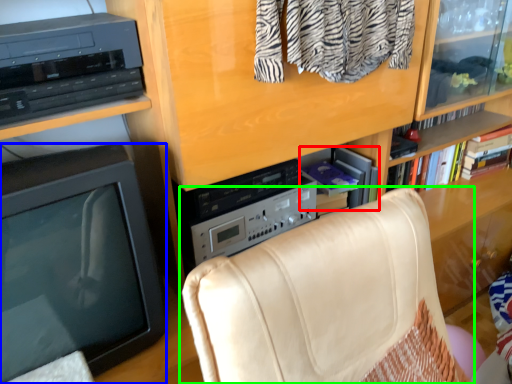
Question: Based on their relative distances, which object is farther from book (highlighted by a red box)? Choose from television (highlighted by a blue box) and chair (highlighted by a green box).

Choices:
 (A) television
 (B) chair

Answer: (A)